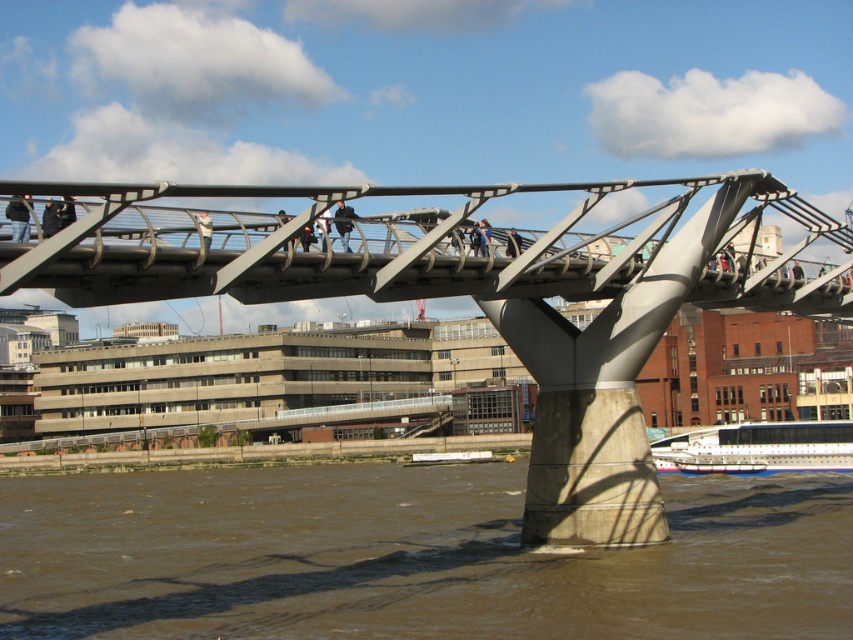
Question: Is brown muddy water at lower center to the left of white matte person at center from the viewer's perspective?

Choices:
 (A) no
 (B) yes

Answer: (B)

Question: Estimate the real-world distances between objects in this image. Which object is closer to the polished steel bridge at center?

Choices:
 (A) black matte pedestrian at center
 (B) dark blue jeans at center
 (C) brown muddy water at lower center

Answer: (B)

Question: Is polished steel bridge at center to the right of dark blue jeans at center from the viewer's perspective?

Choices:
 (A) yes
 (B) no

Answer: (B)

Question: Which object appears farthest from the camera in this image?

Choices:
 (A) polished steel bridge at center
 (B) dark blue jeans at center
 (C) dark blue jeans at left
 (D) brown muddy water at lower center

Answer: (B)

Question: Does polished steel bridge at center appear on the left side of dark blue jeans at left?

Choices:
 (A) no
 (B) yes

Answer: (B)

Question: Which of the following is the closest to the observer?

Choices:
 (A) dark blue jeans at left
 (B) black matte pedestrian at center
 (C) polished steel bridge at center

Answer: (C)